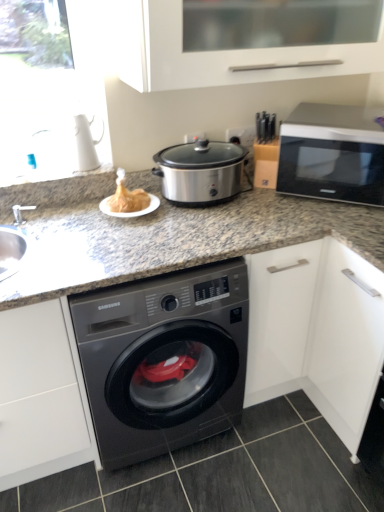
This screenshot has height=512, width=384. Identify the location of vacant space situated above dark gray tile at lower center (from a real-world perspective). (223, 464).